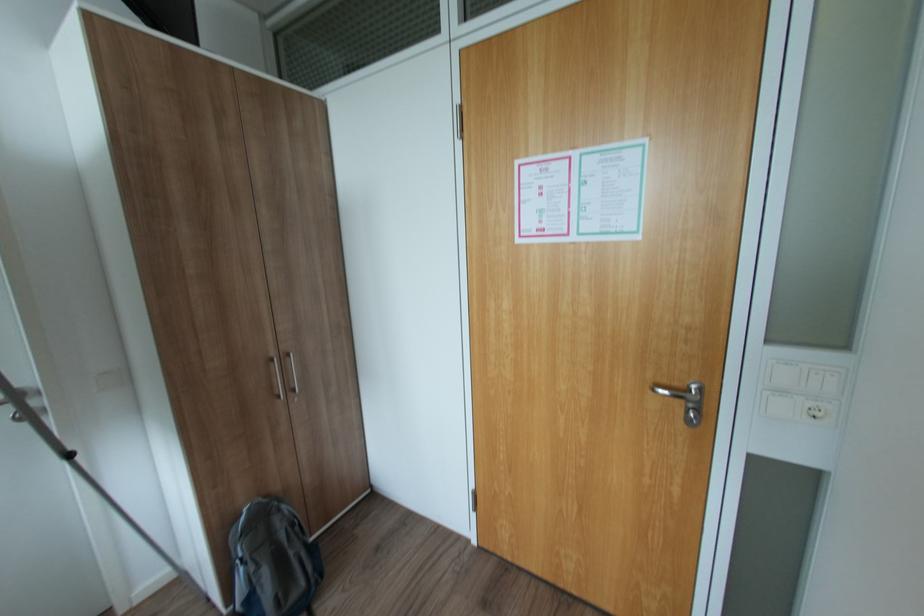
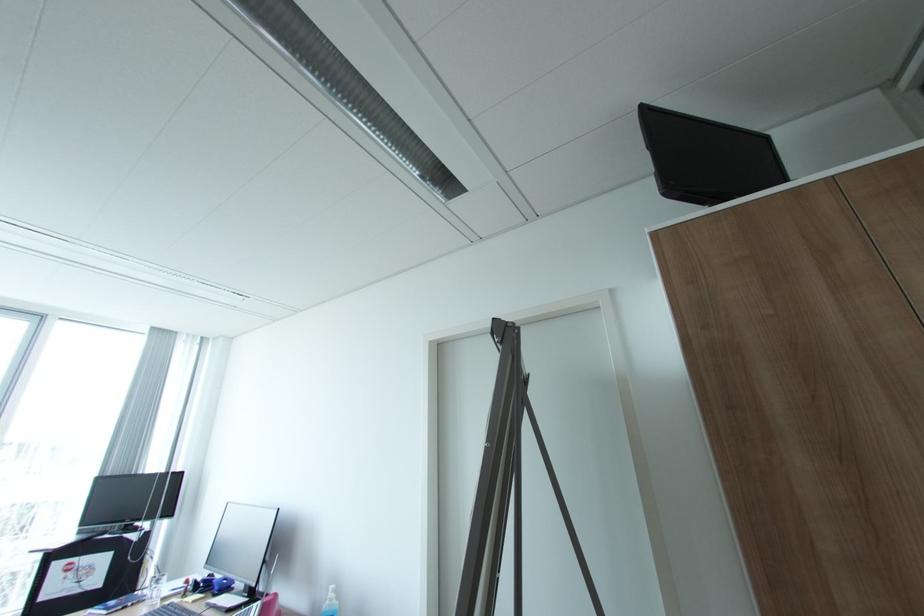
The images are taken continuously from a first-person perspective. In which direction is your viewpoint rotating?

The camera's rotation is toward left-up.